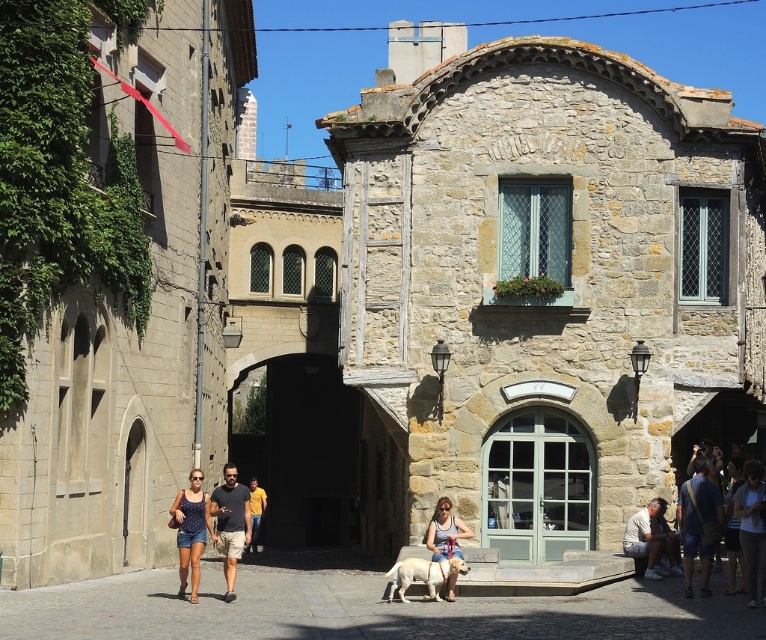
You are a tourist standing on the street and see both the matte gray shirt at lower right and the matte blue shirt at center. Which shirt is positioned higher in the image?

The matte gray shirt at lower right is above the matte blue shirt at center, so it is positioned higher in the image.